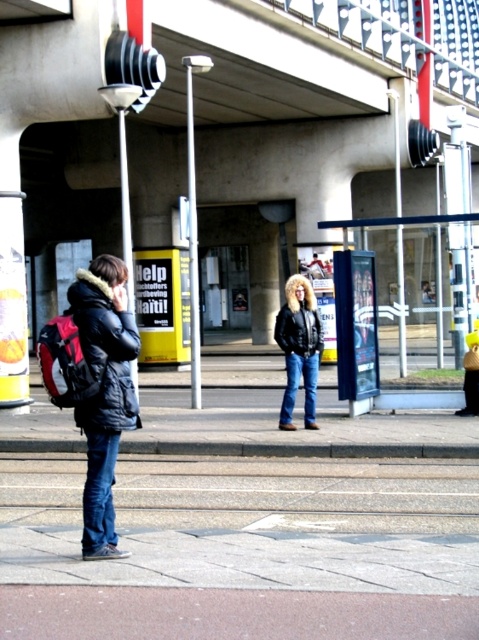
Question: Is black leather jacket at center wider than metallic pole at left?

Choices:
 (A) yes
 (B) no

Answer: (B)

Question: Among these objects, which one is nearest to the camera?

Choices:
 (A) metallic pole at left
 (B) black leather jacket at center
 (C) matte black jacket at left
 (D) blue plastic bus stop at center

Answer: (C)

Question: Is blue plastic bus stop at center below metallic pole at center?

Choices:
 (A) no
 (B) yes

Answer: (B)

Question: Estimate the real-world distances between objects in this image. Which object is farther from the white plastic pole at upper center?

Choices:
 (A) metallic pole at left
 (B) black leather jacket at center

Answer: (A)

Question: Is blue plastic bus stop at center positioned in front of metallic pole at center?

Choices:
 (A) no
 (B) yes

Answer: (B)

Question: Which point is closer to the camera?

Choices:
 (A) black leather jacket at center
 (B) matte black jacket at left
 (C) blue plastic bus stop at center
 (D) white plastic pole at upper center

Answer: (B)